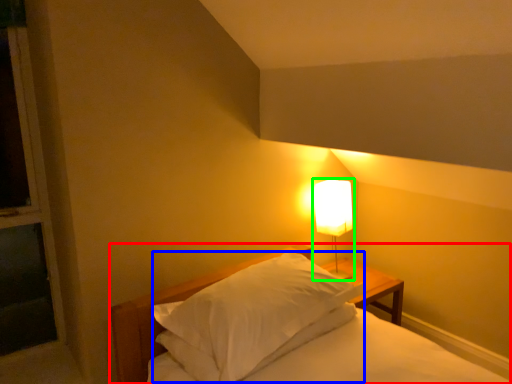
Question: Which object is positioned farthest from bed (highlighted by a red box)? Select from pillow (highlighted by a blue box) and lamp (highlighted by a green box).

Choices:
 (A) pillow
 (B) lamp

Answer: (B)